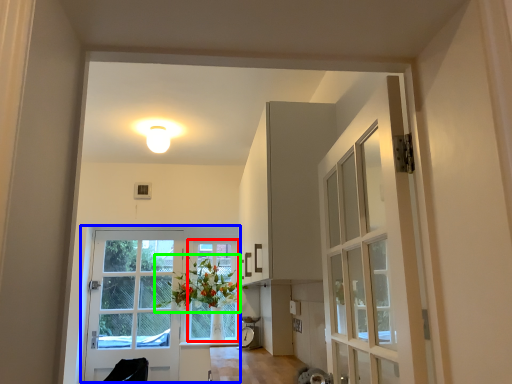
Question: Which object is the closest to the window frame (highlighted by a red box)? Choose among these: door (highlighted by a blue box) or floral arrangement (highlighted by a green box).

Choices:
 (A) door
 (B) floral arrangement

Answer: (B)